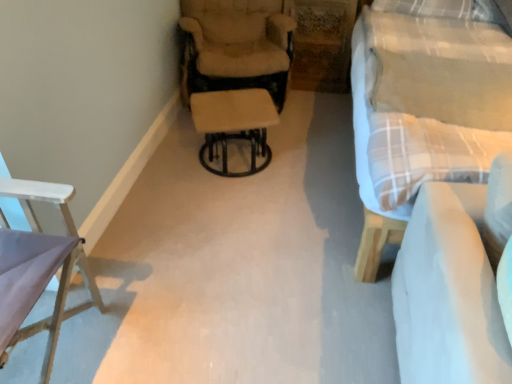
Where is `vacant space to the right of beige fabric chair at center, the 2th chair when ordered from front to back`? vacant space to the right of beige fabric chair at center, the 2th chair when ordered from front to back is located at coordinates (317, 118).